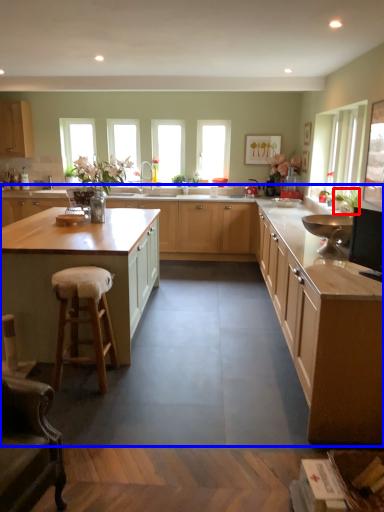
Question: Which point is further to the camera, plant (highlighted by a red box) or cabinetry (highlighted by a blue box)?

Choices:
 (A) plant
 (B) cabinetry

Answer: (A)